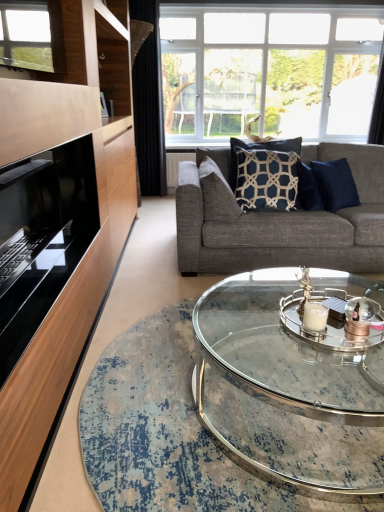
Question: Are black glass fireplace at left and blue textured pillow at center, placed as the 1th pillow when sorted from left to right, far apart?

Choices:
 (A) no
 (B) yes

Answer: (A)

Question: Is black glass fireplace at left thinner than blue textured pillow at center, which is counted as the 2th pillow, starting from the right?

Choices:
 (A) yes
 (B) no

Answer: (B)

Question: Can you confirm if black glass fireplace at left is positioned to the left of blue textured pillow at center, placed as the 1th pillow when sorted from left to right?

Choices:
 (A) no
 (B) yes

Answer: (B)

Question: Considering the relative sizes of black glass fireplace at left and blue textured pillow at center, placed as the 1th pillow when sorted from left to right, in the image provided, is black glass fireplace at left bigger than blue textured pillow at center, placed as the 1th pillow when sorted from left to right,?

Choices:
 (A) yes
 (B) no

Answer: (A)

Question: Is black glass fireplace at left oriented away from blue textured pillow at center, which is counted as the 2th pillow, starting from the right?

Choices:
 (A) yes
 (B) no

Answer: (B)

Question: From a real-world perspective, is black glass fireplace at left located beneath blue textured pillow at center, which is counted as the 2th pillow, starting from the right?

Choices:
 (A) no
 (B) yes

Answer: (A)

Question: Is black fabric curtain at upper right, marked as the first curtain in a right-to-left arrangement, placed right next to clear glass candle holder at center?

Choices:
 (A) yes
 (B) no

Answer: (B)

Question: Is black fabric curtain at upper right, arranged as the 2th curtain when viewed from the left, aimed at clear glass candle holder at center?

Choices:
 (A) no
 (B) yes

Answer: (A)

Question: Is black fabric curtain at upper right, arranged as the 2th curtain when viewed from the left, wider than clear glass candle holder at center?

Choices:
 (A) no
 (B) yes

Answer: (B)

Question: Is black fabric curtain at upper right, arranged as the 2th curtain when viewed from the left, looking in the opposite direction of clear glass candle holder at center?

Choices:
 (A) yes
 (B) no

Answer: (B)

Question: Are black fabric curtain at upper right, arranged as the 2th curtain when viewed from the left, and clear glass candle holder at center located far from each other?

Choices:
 (A) yes
 (B) no

Answer: (A)

Question: Considering the relative sizes of black fabric curtain at upper right, arranged as the 2th curtain when viewed from the left, and clear glass candle holder at center in the image provided, is black fabric curtain at upper right, arranged as the 2th curtain when viewed from the left, taller than clear glass candle holder at center?

Choices:
 (A) yes
 (B) no

Answer: (A)

Question: Considering the relative sizes of clear glass candle holder at center and black glass fireplace at left in the image provided, is clear glass candle holder at center smaller than black glass fireplace at left?

Choices:
 (A) no
 (B) yes

Answer: (B)